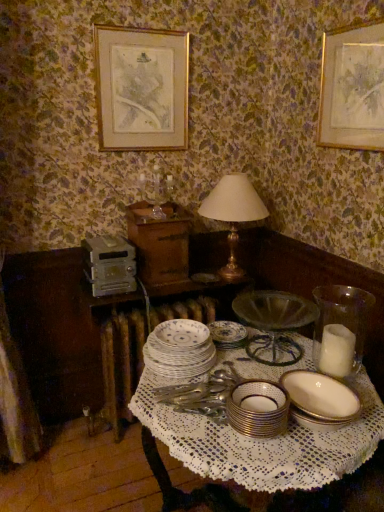
Question: From a real-world perspective, is white porcelain plates at center, the third tableware viewed from the right, positioned under white porcelain table at center based on gravity?

Choices:
 (A) yes
 (B) no

Answer: (B)

Question: Considering the relative sizes of white porcelain plates at center, which is counted as the 1th tableware, starting from the left, and white porcelain table at center in the image provided, is white porcelain plates at center, which is counted as the 1th tableware, starting from the left, thinner than white porcelain table at center?

Choices:
 (A) yes
 (B) no

Answer: (A)

Question: Considering the relative positions of white porcelain plates at center, the third tableware viewed from the right, and white porcelain table at center in the image provided, is white porcelain plates at center, the third tableware viewed from the right, to the right of white porcelain table at center from the viewer's perspective?

Choices:
 (A) yes
 (B) no

Answer: (A)

Question: Does white porcelain plates at center, which is the 3th tableware in front-to-back order, turn towards white porcelain table at center?

Choices:
 (A) no
 (B) yes

Answer: (A)

Question: Does white porcelain plates at center, placed as the first tableware when sorted from back to front, have a smaller size compared to white porcelain table at center?

Choices:
 (A) yes
 (B) no

Answer: (A)

Question: Is porcelain plate at center in front of or behind gold metallic table lamp at center in the image?

Choices:
 (A) front
 (B) behind

Answer: (A)

Question: Is porcelain plate at center to the left or to the right of gold metallic table lamp at center in the image?

Choices:
 (A) right
 (B) left

Answer: (B)

Question: In terms of size, does porcelain plate at center appear bigger or smaller than gold metallic table lamp at center?

Choices:
 (A) small
 (B) big

Answer: (A)

Question: Is porcelain plate at center wider or thinner than gold metallic table lamp at center?

Choices:
 (A) wide
 (B) thin

Answer: (B)

Question: In terms of width, does white glass candle at right, which ranks as the 2th tableware in back-to-front order, look wider or thinner when compared to gold metallic table lamp at center?

Choices:
 (A) wide
 (B) thin

Answer: (B)

Question: Considering the positions of white glass candle at right, which ranks as the first tableware in right-to-left order, and gold metallic table lamp at center in the image, is white glass candle at right, which ranks as the first tableware in right-to-left order, bigger or smaller than gold metallic table lamp at center?

Choices:
 (A) big
 (B) small

Answer: (B)

Question: In the image, is white glass candle at right, which ranks as the first tableware in right-to-left order, on the left side or the right side of gold metallic table lamp at center?

Choices:
 (A) left
 (B) right

Answer: (B)

Question: Does point (370, 307) appear closer or farther from the camera than point (230, 238)?

Choices:
 (A) closer
 (B) farther

Answer: (A)

Question: Is white porcelain plates at center, the third tableware viewed from the right, taller or shorter than white porcelain table at center?

Choices:
 (A) short
 (B) tall

Answer: (A)

Question: Considering the positions of white porcelain plates at center, the third tableware viewed from the right, and white porcelain table at center in the image, is white porcelain plates at center, the third tableware viewed from the right, bigger or smaller than white porcelain table at center?

Choices:
 (A) big
 (B) small

Answer: (B)